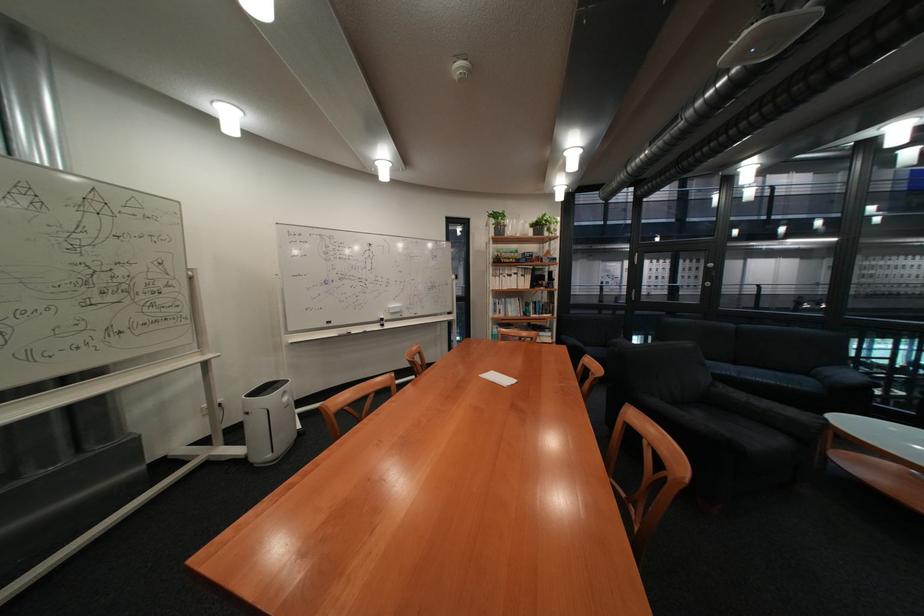
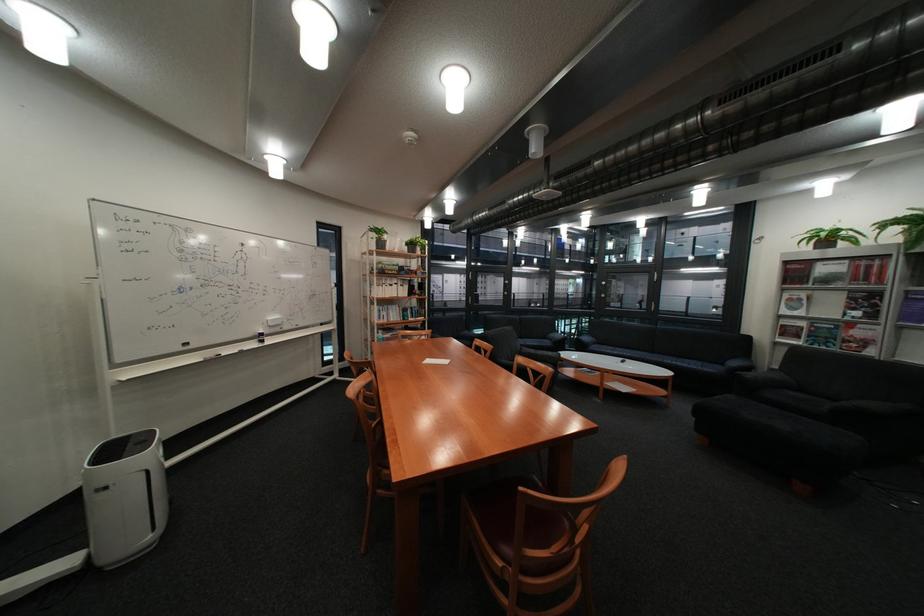
The point at [405,307] is marked in the first image. Where is the corresponding point in the second image?

(284, 318)